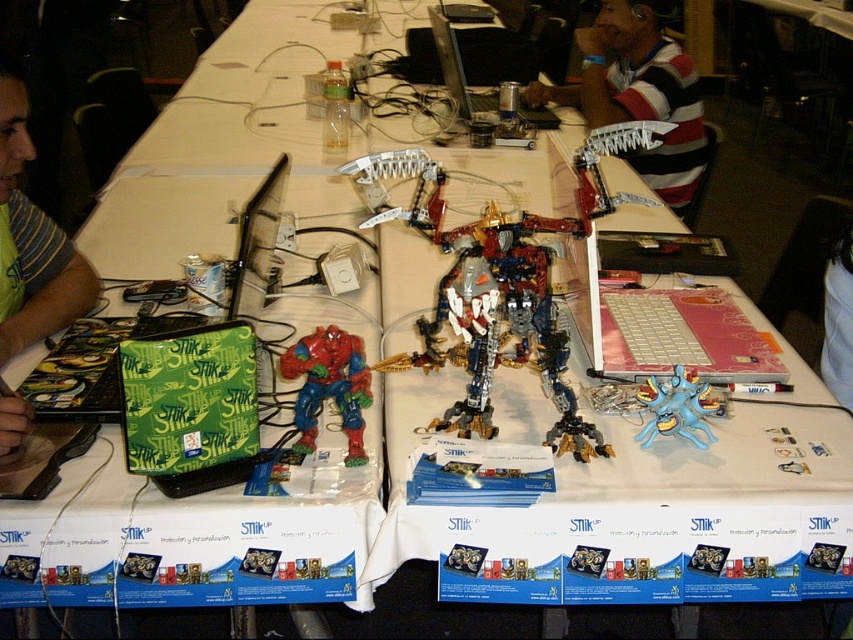
Question: Which point is farther to the camera?

Choices:
 (A) (566, 436)
 (B) (76, 310)
 (C) (683, 374)
 (D) (358, 401)

Answer: (B)

Question: Which point is closer to the camera?

Choices:
 (A) metallic gold robot at center
 (B) striped shirt at upper right
 (C) shiny plastic action figure at center

Answer: (C)

Question: Observing the image, what is the correct spatial positioning of striped shirt at upper right in reference to green matte laptop at left?

Choices:
 (A) above
 (B) below

Answer: (A)

Question: From the image, what is the correct spatial relationship of blue rubber toy at center in relation to metallic gold robot at center?

Choices:
 (A) left
 (B) right

Answer: (B)

Question: Does green matte laptop at left have a smaller size compared to metallic silver laptop at center?

Choices:
 (A) no
 (B) yes

Answer: (B)

Question: Which of the following is the closest to the observer?

Choices:
 (A) striped shirt at upper right
 (B) metallic gold robot at center
 (C) green matte laptop at left

Answer: (B)